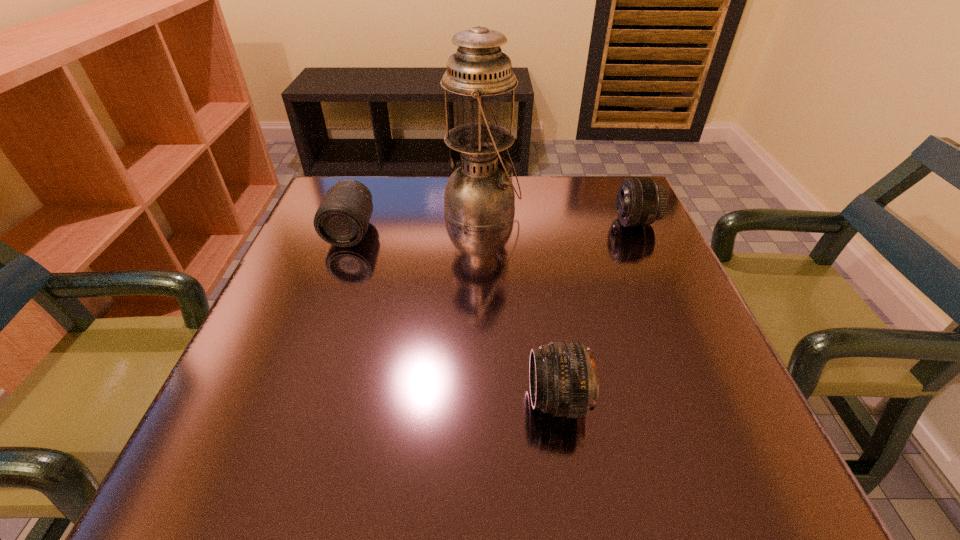
This screenshot has height=540, width=960. In order to click on vacant space located 0.230m at the front element of the nearest telephoto lens in this screenshot , I will do `click(382, 400)`.

Identify the location of vacant position located at the front element of the nearest telephoto lens. (434, 400).

Where is `blank space located 0.330m at the front element of the nearest telephoto lens`? blank space located 0.330m at the front element of the nearest telephoto lens is located at coordinates (319, 400).

The image size is (960, 540). I want to click on oil lamp located at the far edge, so click(x=479, y=195).

The height and width of the screenshot is (540, 960). I want to click on object positioned at the near edge, so click(563, 382).

Identify the location of object located in the left edge section of the desktop. The height and width of the screenshot is (540, 960). (342, 219).

You are a GUI agent. You are given a task and a screenshot of the screen. Output one action in this format:
    pyautogui.click(x=<x>, y=<y>)
    Task: Click on the object positioned at the right edge
    The image size is (960, 540).
    Given the screenshot: What is the action you would take?
    (640, 202)

Where is `object that is at the far left corner`? The height and width of the screenshot is (540, 960). object that is at the far left corner is located at coordinates (342, 219).

Where is `object present at the far right corner`? This screenshot has width=960, height=540. object present at the far right corner is located at coordinates (640, 202).

What are the coordinates of `vacant space at the far edge of the desktop` in the screenshot? It's located at (564, 202).